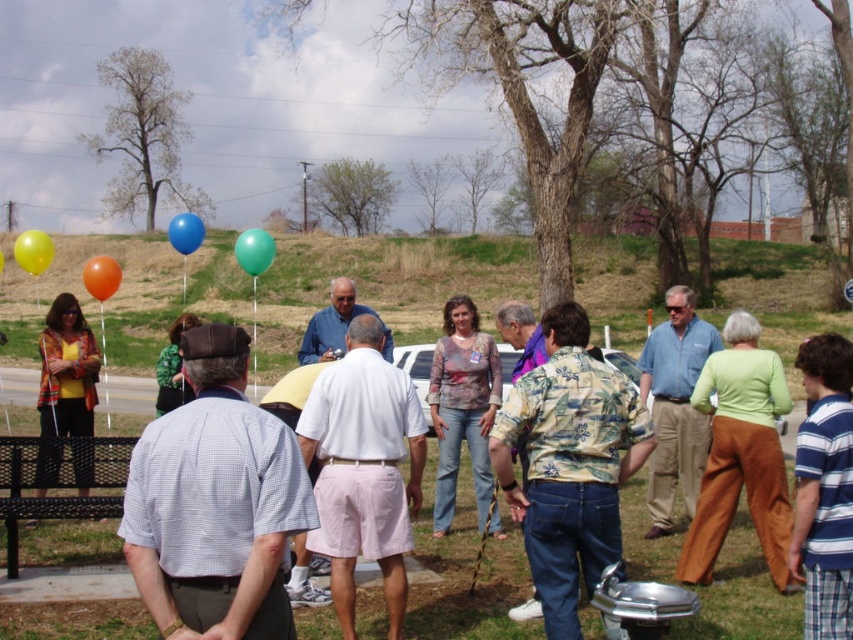
You are planning to hang a banner from the metallic silver grill at center to the matte yellow balloon at upper left. Considering their heights, will the banner need to be adjusted to reach both objects?

The metallic silver grill at center is much taller than the matte yellow balloon at upper left, so the banner will need to be adjusted to reach both objects since their heights differ significantly.

You are planning to set up a picnic blanket in this park scene. The picnic blanket needs to be placed between the metallic silver grill at center and the blue rubber balloon at upper left. Considering their positions, which object should the blanket be closer to?

The metallic silver grill at center is taller than the blue rubber balloon at upper left, so the picnic blanket should be placed closer to the blue rubber balloon at upper left to ensure it is within the visible area of the scene.